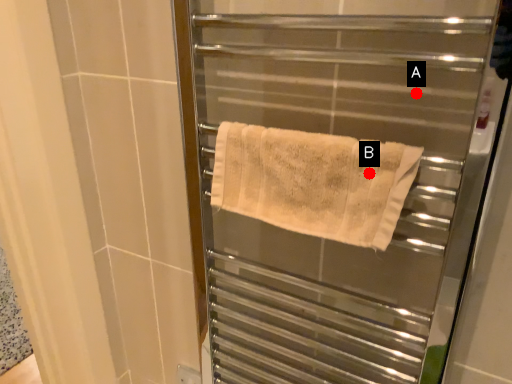
Question: Two points are circled on the image, labeled by A and B beside each circle. Which point is closer to the camera?

Choices:
 (A) A is closer
 (B) B is closer

Answer: (B)